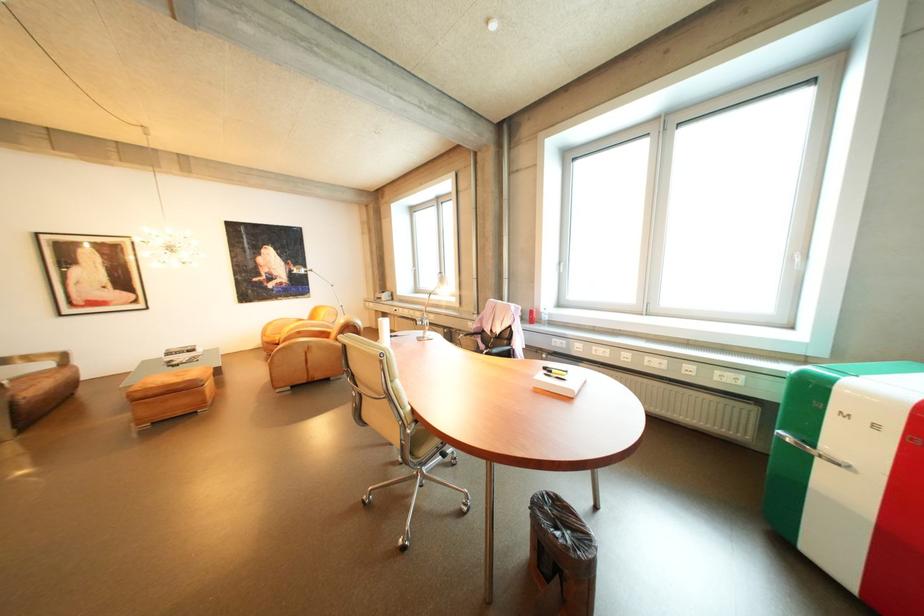
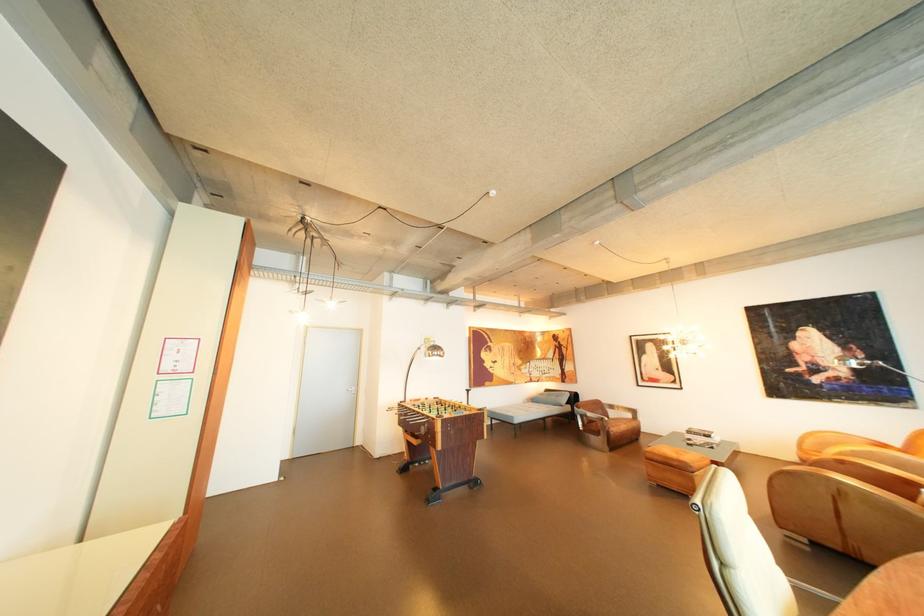
Question: Based on the continuous images, in which direction is the camera rotating? Reply with the corresponding letter.

Choices:
 (A) Left
 (B) Right
 (C) Up
 (D) Down

Answer: (A)